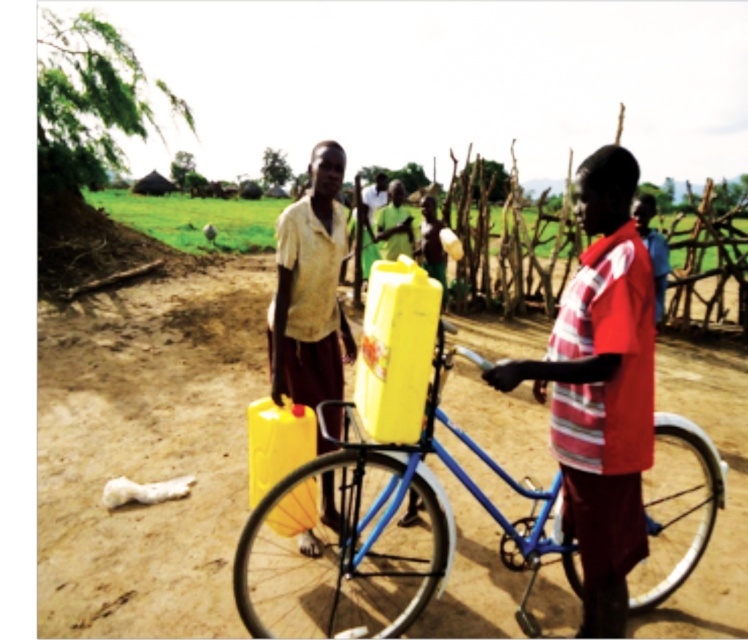
At what (x,y) coordinates should I click in order to perform the action: click on blue metallic bicycle at center. Please return your answer as a coordinate pair (x, y). This screenshot has height=640, width=748. Looking at the image, I should click on (378, 538).

Between blue metallic bicycle at center and matte red shirt at center, which one is positioned higher?

Positioned higher is matte red shirt at center.

This screenshot has width=748, height=640. What are the coordinates of `blue metallic bicycle at center` in the screenshot? It's located at (378, 538).

This screenshot has height=640, width=748. In order to click on blue metallic bicycle at center in this screenshot , I will do `click(378, 538)`.

Does matte red shirt at center have a greater width compared to matte yellow plastic jerrycan at center?

Yes, matte red shirt at center is wider than matte yellow plastic jerrycan at center.

Does matte red shirt at center lie in front of matte yellow plastic jerrycan at center?

Yes, matte red shirt at center is in front of matte yellow plastic jerrycan at center.

Find the location of a particular element. matte red shirt at center is located at coordinates (600, 388).

Can you confirm if blue metallic bicycle at center is wider than matte yellow plastic jerrycan at center?

Yes.

Can you confirm if blue metallic bicycle at center is positioned above matte yellow plastic jerrycan at center?

No, blue metallic bicycle at center is not above matte yellow plastic jerrycan at center.

Is point (499, 477) behind point (269, 308)?

Yes.

Find the location of a particular element. blue metallic bicycle at center is located at coordinates (378, 538).